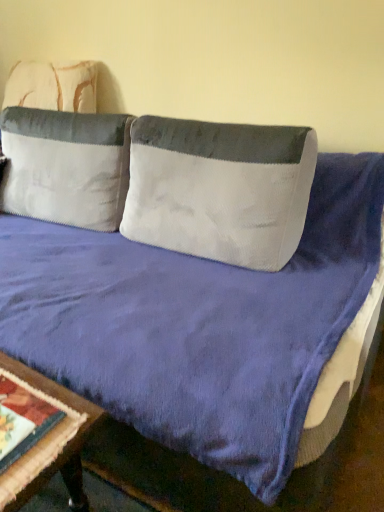
How much space does white velvety pillow at upper left, which is the 1th pillow from left to right, occupy vertically?

white velvety pillow at upper left, which is the 1th pillow from left to right, is 23.99 inches in height.

The width and height of the screenshot is (384, 512). Identify the location of white textured pillow at center, the 2th pillow when ordered from left to right. (219, 189).

Where is `white velvety pillow at upper left, which is the 1th pillow from left to right`? The image size is (384, 512). white velvety pillow at upper left, which is the 1th pillow from left to right is located at coordinates (66, 166).

Does wooden table at lower left turn towards white textured pillow at center, the 2th pillow when ordered from left to right?

No, wooden table at lower left is not facing towards white textured pillow at center, the 2th pillow when ordered from left to right.

Between wooden table at lower left and white textured pillow at center, the 2th pillow when ordered from left to right, which one has less height?

wooden table at lower left is shorter.

Considering the positions of points (17, 366) and (191, 190), is point (17, 366) closer to camera compared to point (191, 190)?

Yes, point (17, 366) is in front of point (191, 190).

Which is less distant, [70,397] or [97,140]?

Point [70,397] is positioned closer to the camera compared to point [97,140].

Considering the sizes of wooden table at lower left and white velvety pillow at upper left, which is the 1th pillow from left to right, in the image, is wooden table at lower left taller or shorter than white velvety pillow at upper left, which is the 1th pillow from left to right,?

Clearly, wooden table at lower left is shorter compared to white velvety pillow at upper left, which is the 1th pillow from left to right.

The height and width of the screenshot is (512, 384). Find the location of `table lying below the white velvety pillow at upper left, which ranks as the 2th pillow in right-to-left order (from the image's perspective)`. table lying below the white velvety pillow at upper left, which ranks as the 2th pillow in right-to-left order (from the image's perspective) is located at coordinates (69, 441).

Looking at this image, can you confirm if white velvety pillow at upper left, which ranks as the 2th pillow in right-to-left order, is positioned to the left of wooden table at lower left?

Correct, you'll find white velvety pillow at upper left, which ranks as the 2th pillow in right-to-left order, to the left of wooden table at lower left.

From a real-world perspective, is white velvety pillow at upper left, which is the 1th pillow from left to right, positioned under wooden table at lower left based on gravity?

Actually, white velvety pillow at upper left, which is the 1th pillow from left to right, is physically above wooden table at lower left in the real world.

Is white velvety pillow at upper left, which ranks as the 2th pillow in right-to-left order, in front of wooden table at lower left?

No, the depth of white velvety pillow at upper left, which ranks as the 2th pillow in right-to-left order, is greater than that of wooden table at lower left.

Which of these two, white velvety pillow at upper left, which is the 1th pillow from left to right, or white textured pillow at center, arranged as the 1th pillow when viewed from the right, is bigger?

white velvety pillow at upper left, which is the 1th pillow from left to right.

From the image's perspective, would you say white velvety pillow at upper left, which ranks as the 2th pillow in right-to-left order, is positioned over white textured pillow at center, arranged as the 1th pillow when viewed from the right?

Yes, from the image's perspective, white velvety pillow at upper left, which ranks as the 2th pillow in right-to-left order, is on top of white textured pillow at center, arranged as the 1th pillow when viewed from the right.

Does point (65, 190) lie in front of point (166, 118)?

No, (65, 190) is behind (166, 118).

Considering the sizes of objects white velvety pillow at upper left, which ranks as the 2th pillow in right-to-left order, and white textured pillow at center, the 2th pillow when ordered from left to right, in the image provided, who is wider, white velvety pillow at upper left, which ranks as the 2th pillow in right-to-left order, or white textured pillow at center, the 2th pillow when ordered from left to right,?

Wider between the two is white velvety pillow at upper left, which ranks as the 2th pillow in right-to-left order.

Is white textured pillow at center, the 2th pillow when ordered from left to right, outside of white velvety pillow at upper left, which ranks as the 2th pillow in right-to-left order?

Yes.

Considering the sizes of objects white textured pillow at center, arranged as the 1th pillow when viewed from the right, and white velvety pillow at upper left, which is the 1th pillow from left to right, in the image provided, who is smaller, white textured pillow at center, arranged as the 1th pillow when viewed from the right, or white velvety pillow at upper left, which is the 1th pillow from left to right,?

Smaller between the two is white textured pillow at center, arranged as the 1th pillow when viewed from the right.

From a real-world perspective, is white textured pillow at center, the 2th pillow when ordered from left to right, positioned over white velvety pillow at upper left, which is the 1th pillow from left to right, based on gravity?

Correct, in the physical world, white textured pillow at center, the 2th pillow when ordered from left to right, is higher than white velvety pillow at upper left, which is the 1th pillow from left to right.

Which object is closer to the camera taking this photo, white textured pillow at center, the 2th pillow when ordered from left to right, or white velvety pillow at upper left, which is the 1th pillow from left to right?

white textured pillow at center, the 2th pillow when ordered from left to right.

Does point (272, 156) appear closer or farther from the camera than point (28, 380)?

Point (272, 156) is farther from the camera than point (28, 380).

Does white textured pillow at center, the 2th pillow when ordered from left to right, turn towards wooden table at lower left?

Yes, white textured pillow at center, the 2th pillow when ordered from left to right, is oriented towards wooden table at lower left.

Identify the location of table below the white textured pillow at center, arranged as the 1th pillow when viewed from the right (from a real-world perspective). (69, 441).

Where is `table to the left of white textured pillow at center, the 2th pillow when ordered from left to right`? This screenshot has width=384, height=512. table to the left of white textured pillow at center, the 2th pillow when ordered from left to right is located at coordinates (69, 441).

What are the coordinates of `table located in front of the white velvety pillow at upper left, which is the 1th pillow from left to right` in the screenshot? It's located at (69, 441).

Estimate the real-world distances between objects in this image. Which object is closer to wooden table at lower left, white textured pillow at center, arranged as the 1th pillow when viewed from the right, or white velvety pillow at upper left, which is the 1th pillow from left to right?

white textured pillow at center, arranged as the 1th pillow when viewed from the right.

Estimate the real-world distances between objects in this image. Which object is further from white velvety pillow at upper left, which is the 1th pillow from left to right, white textured pillow at center, the 2th pillow when ordered from left to right, or wooden table at lower left?

wooden table at lower left is further to white velvety pillow at upper left, which is the 1th pillow from left to right.

Looking at the image, which one is located closer to white textured pillow at center, the 2th pillow when ordered from left to right, white velvety pillow at upper left, which ranks as the 2th pillow in right-to-left order, or wooden table at lower left?

white velvety pillow at upper left, which ranks as the 2th pillow in right-to-left order.

Looking at the image, which one is located further to white textured pillow at center, arranged as the 1th pillow when viewed from the right, wooden table at lower left or white velvety pillow at upper left, which is the 1th pillow from left to right?

wooden table at lower left is further to white textured pillow at center, arranged as the 1th pillow when viewed from the right.

Looking at the image, which one is located closer to white velvety pillow at upper left, which ranks as the 2th pillow in right-to-left order, wooden table at lower left or white textured pillow at center, arranged as the 1th pillow when viewed from the right?

white textured pillow at center, arranged as the 1th pillow when viewed from the right, lies closer to white velvety pillow at upper left, which ranks as the 2th pillow in right-to-left order, than the other object.

Estimate the real-world distances between objects in this image. Which object is closer to wooden table at lower left, white velvety pillow at upper left, which is the 1th pillow from left to right, or white textured pillow at center, arranged as the 1th pillow when viewed from the right?

Among the two, white textured pillow at center, arranged as the 1th pillow when viewed from the right, is located nearer to wooden table at lower left.

Find the location of a particular element. The width and height of the screenshot is (384, 512). pillow between white velvety pillow at upper left, which is the 1th pillow from left to right, and wooden table at lower left vertically is located at coordinates (219, 189).